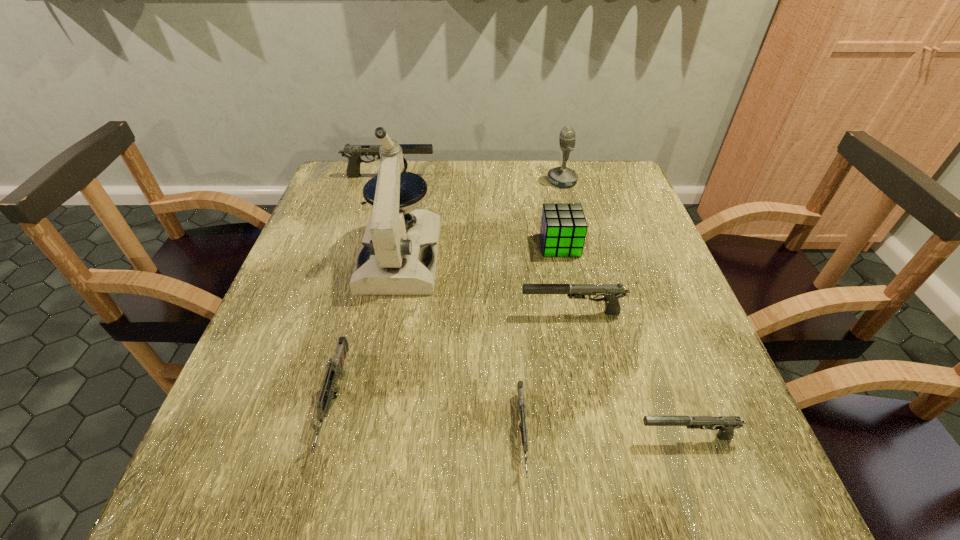
I want to click on the tallest object, so click(393, 260).

Find the location of `the second tallest object`. the second tallest object is located at coordinates (562, 176).

Locate an element on the screen. the leftmost gray gun is located at coordinates (353, 152).

This screenshot has height=540, width=960. In order to click on the farthest gun in this screenshot , I will do `click(353, 152)`.

At what (x,y) coordinates should I click in order to perform the action: click on red cube. Please return your answer as a coordinate pair (x, y). Looking at the image, I should click on pos(563,228).

You are a GUI agent. You are given a task and a screenshot of the screen. Output one action in this format:
    pyautogui.click(x=<x>, y=<y>)
    Task: Click on the second farthest gray gun
    Image resolution: width=960 pixels, height=540 pixels.
    Given the screenshot: What is the action you would take?
    pyautogui.click(x=612, y=292)

Identify the location of the fifth farthest object. The height and width of the screenshot is (540, 960). (612, 292).

I want to click on the bigger grey gun, so click(x=330, y=388).

At what (x,y) coordinates should I click in order to perform the action: click on the nearest gray gun. Please return your answer as a coordinate pair (x, y). This screenshot has height=540, width=960. Looking at the image, I should click on (725, 424).

The height and width of the screenshot is (540, 960). Find the location of `the third gun from left to right`. the third gun from left to right is located at coordinates (524, 433).